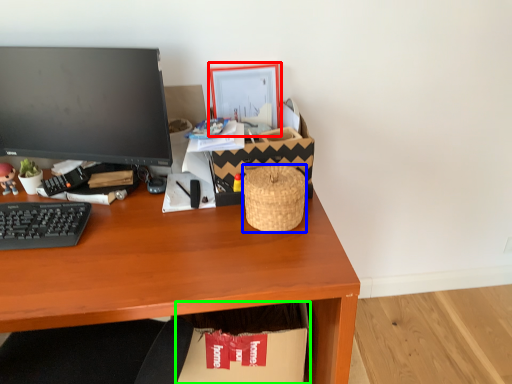
Question: Based on their relative distances, which object is farther from picture frame (highlighted by a red box)? Choose from basket (highlighted by a blue box) and cardboard box (highlighted by a green box).

Choices:
 (A) basket
 (B) cardboard box

Answer: (B)